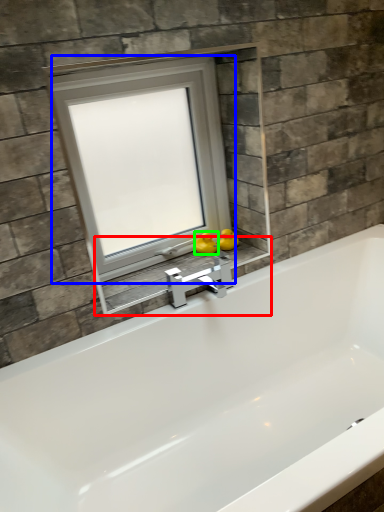
Question: Which object is the farthest from window sill (highlighted by a red box)? Choose among these: window (highlighted by a blue box) or duck (highlighted by a green box).

Choices:
 (A) window
 (B) duck

Answer: (A)